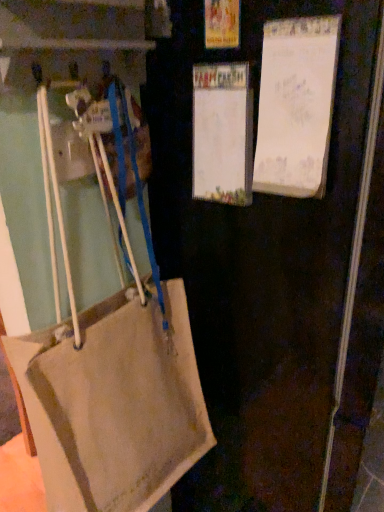
What do you see at coordinates (111, 377) in the screenshot?
I see `beige canvas handbag at lower left` at bounding box center [111, 377].

The width and height of the screenshot is (384, 512). In order to click on beige fabric bag at left in this screenshot , I will do `click(259, 269)`.

Between white paper at center, which is counted as the 1th bulletin board, starting from the left, and beige fabric bag at left, which one has larger width?

beige fabric bag at left is wider.

Which object is positioned more to the left, white paper at center, which is counted as the 1th bulletin board, starting from the left, or beige fabric bag at left?

Positioned to the left is white paper at center, which is counted as the 1th bulletin board, starting from the left.

Is white paper at center, the 2th bulletin board viewed from the right, taller or shorter than beige fabric bag at left?

white paper at center, the 2th bulletin board viewed from the right, is shorter than beige fabric bag at left.

Considering the relative positions of white paper at upper right, acting as the second bulletin board starting from the left, and beige fabric bag at left in the image provided, is white paper at upper right, acting as the second bulletin board starting from the left, in front of beige fabric bag at left?

No, white paper at upper right, acting as the second bulletin board starting from the left, is further to the viewer.

Which is more to the right, white paper at upper right, which appears as the first bulletin board when viewed from the right, or beige fabric bag at left?

beige fabric bag at left.

From the picture: From a real-world perspective, is white paper at upper right, acting as the second bulletin board starting from the left, physically located above or below beige fabric bag at left?

Clearly, from a real-world perspective, white paper at upper right, acting as the second bulletin board starting from the left, is above beige fabric bag at left.

Looking at this image, is beige fabric bag at left taller than white paper at upper right, which appears as the first bulletin board when viewed from the right?

Yes, beige fabric bag at left is taller than white paper at upper right, which appears as the first bulletin board when viewed from the right.

Considering the sizes of objects beige fabric bag at left and white paper at upper right, which appears as the first bulletin board when viewed from the right, in the image provided, who is smaller, beige fabric bag at left or white paper at upper right, which appears as the first bulletin board when viewed from the right,?

white paper at upper right, which appears as the first bulletin board when viewed from the right, is smaller.

Is beige fabric bag at left oriented towards white paper at upper right, which appears as the first bulletin board when viewed from the right?

No.

In the scene shown: From the image's perspective, does beige fabric bag at left appear higher than white paper at upper right, which appears as the first bulletin board when viewed from the right?

No, from the image's perspective, beige fabric bag at left is not above white paper at upper right, which appears as the first bulletin board when viewed from the right.

Relative to beige canvas handbag at lower left, is white paper at upper right, which appears as the first bulletin board when viewed from the right, in front or behind?

Visually, white paper at upper right, which appears as the first bulletin board when viewed from the right, is located behind beige canvas handbag at lower left.

From the picture: Is white paper at upper right, acting as the second bulletin board starting from the left, inside the boundaries of beige canvas handbag at lower left, or outside?

white paper at upper right, acting as the second bulletin board starting from the left, exists outside the volume of beige canvas handbag at lower left.

Is white paper at upper right, acting as the second bulletin board starting from the left, far away from beige canvas handbag at lower left?

That's not correct — white paper at upper right, acting as the second bulletin board starting from the left, is a little close to beige canvas handbag at lower left.

Considering the sizes of beige fabric bag at left and beige canvas handbag at lower left in the image, is beige fabric bag at left wider or thinner than beige canvas handbag at lower left?

Clearly, beige fabric bag at left has more width compared to beige canvas handbag at lower left.

In the image, is beige fabric bag at left positioned in front of or behind beige canvas handbag at lower left?

Visually, beige fabric bag at left is located in front of beige canvas handbag at lower left.

Does point (242, 439) come farther from viewer compared to point (6, 348)?

Yes, it is.

Is beige fabric bag at left facing away from beige canvas handbag at lower left?

No, beige fabric bag at left is not facing the opposite direction of beige canvas handbag at lower left.

Is point (208, 87) less distant than point (271, 119)?

No, (208, 87) is further to viewer.

Locate an element on the screen. Image resolution: width=384 pixels, height=512 pixels. bulletin board that appears in front of the white paper at center, the 2th bulletin board viewed from the right is located at coordinates (296, 106).

Can you confirm if white paper at center, which is counted as the 1th bulletin board, starting from the left, is taller than white paper at upper right, acting as the second bulletin board starting from the left?

No.

Is there a large distance between white paper at center, which is counted as the 1th bulletin board, starting from the left, and white paper at upper right, acting as the second bulletin board starting from the left?

That's not correct — white paper at center, which is counted as the 1th bulletin board, starting from the left, is a little close to white paper at upper right, acting as the second bulletin board starting from the left.

In the image, is beige canvas handbag at lower left on the left side or the right side of white paper at upper right, which appears as the first bulletin board when viewed from the right?

beige canvas handbag at lower left is positioned on white paper at upper right, which appears as the first bulletin board when viewed from the right,'s left side.

Considering the positions of objects beige canvas handbag at lower left and white paper at upper right, which appears as the first bulletin board when viewed from the right, in the image provided, who is behind, beige canvas handbag at lower left or white paper at upper right, which appears as the first bulletin board when viewed from the right,?

white paper at upper right, which appears as the first bulletin board when viewed from the right.

From a real-world perspective, is beige canvas handbag at lower left physically above white paper at upper right, acting as the second bulletin board starting from the left?

No, from a real-world perspective, beige canvas handbag at lower left is not on top of white paper at upper right, acting as the second bulletin board starting from the left.

Starting from the beige fabric bag at left, which bulletin board is the 2nd one to the left? Please provide its 2D coordinates.

[(222, 134)]

The height and width of the screenshot is (512, 384). I want to click on the 2nd bulletin board directly above the beige fabric bag at left (from a real-world perspective), so click(296, 106).

In the scene shown: Which object lies further to the anchor point beige fabric bag at left, white paper at upper right, which appears as the first bulletin board when viewed from the right, or white paper at center, which is counted as the 1th bulletin board, starting from the left?

The object further to beige fabric bag at left is white paper at upper right, which appears as the first bulletin board when viewed from the right.

Considering their positions, is white paper at upper right, which appears as the first bulletin board when viewed from the right, positioned further to beige fabric bag at left than beige canvas handbag at lower left?

white paper at upper right, which appears as the first bulletin board when viewed from the right, is further to beige fabric bag at left.

Based on their spatial positions, is white paper at center, which is counted as the 1th bulletin board, starting from the left, or white paper at upper right, which appears as the first bulletin board when viewed from the right, closer to beige canvas handbag at lower left?

The object closer to beige canvas handbag at lower left is white paper at center, which is counted as the 1th bulletin board, starting from the left.

When comparing their distances from white paper at center, which is counted as the 1th bulletin board, starting from the left, does white paper at upper right, acting as the second bulletin board starting from the left, or beige canvas handbag at lower left seem closer?

Among the two, white paper at upper right, acting as the second bulletin board starting from the left, is located nearer to white paper at center, which is counted as the 1th bulletin board, starting from the left.

Which object lies further to the anchor point white paper at upper right, which appears as the first bulletin board when viewed from the right, white paper at center, the 2th bulletin board viewed from the right, or beige fabric bag at left?

beige fabric bag at left lies further to white paper at upper right, which appears as the first bulletin board when viewed from the right, than the other object.

Based on their spatial positions, is white paper at center, which is counted as the 1th bulletin board, starting from the left, or beige canvas handbag at lower left further from beige fabric bag at left?

Based on the image, white paper at center, which is counted as the 1th bulletin board, starting from the left, appears to be further to beige fabric bag at left.

Based on their spatial positions, is beige canvas handbag at lower left or beige fabric bag at left closer to white paper at center, which is counted as the 1th bulletin board, starting from the left?

beige fabric bag at left is closer to white paper at center, which is counted as the 1th bulletin board, starting from the left.

From the image, which object appears to be farther from beige canvas handbag at lower left, beige fabric bag at left or white paper at center, the 2th bulletin board viewed from the right?

white paper at center, the 2th bulletin board viewed from the right, lies further to beige canvas handbag at lower left than the other object.

You are a GUI agent. You are given a task and a screenshot of the screen. Output one action in this format:
    pyautogui.click(x=<x>, y=<y>)
    Task: Click on the handbag that lies between white paper at upper right, acting as the second bulletin board starting from the left, and beige fabric bag at left from top to bottom
    
    Given the screenshot: What is the action you would take?
    pyautogui.click(x=111, y=377)

Find the location of `bulletin board between white paper at upper right, acting as the second bulletin board starting from the left, and beige canvas handbag at lower left, in the vertical direction`. bulletin board between white paper at upper right, acting as the second bulletin board starting from the left, and beige canvas handbag at lower left, in the vertical direction is located at coordinates (222, 134).

The height and width of the screenshot is (512, 384). I want to click on handbag between white paper at center, which is counted as the 1th bulletin board, starting from the left, and beige fabric bag at left, in the vertical direction, so click(x=111, y=377).

This screenshot has height=512, width=384. What are the coordinates of `bulletin board between white paper at upper right, acting as the second bulletin board starting from the left, and beige fabric bag at left in the up-down direction` in the screenshot? It's located at (222, 134).